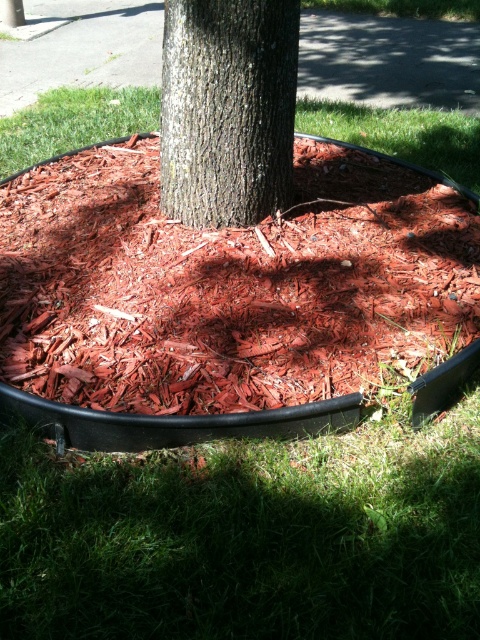
Question: Considering the relative positions of red mulch at center and smooth bark tree trunk at center in the image provided, where is red mulch at center located with respect to smooth bark tree trunk at center?

Choices:
 (A) left
 (B) right

Answer: (A)

Question: Can you confirm if red mulch at center is thinner than smooth bark tree trunk at center?

Choices:
 (A) no
 (B) yes

Answer: (A)

Question: Can you confirm if red mulch at center is thinner than smooth bark tree trunk at center?

Choices:
 (A) yes
 (B) no

Answer: (B)

Question: Which point appears closest to the camera in this image?

Choices:
 (A) (116, 166)
 (B) (240, 102)

Answer: (B)